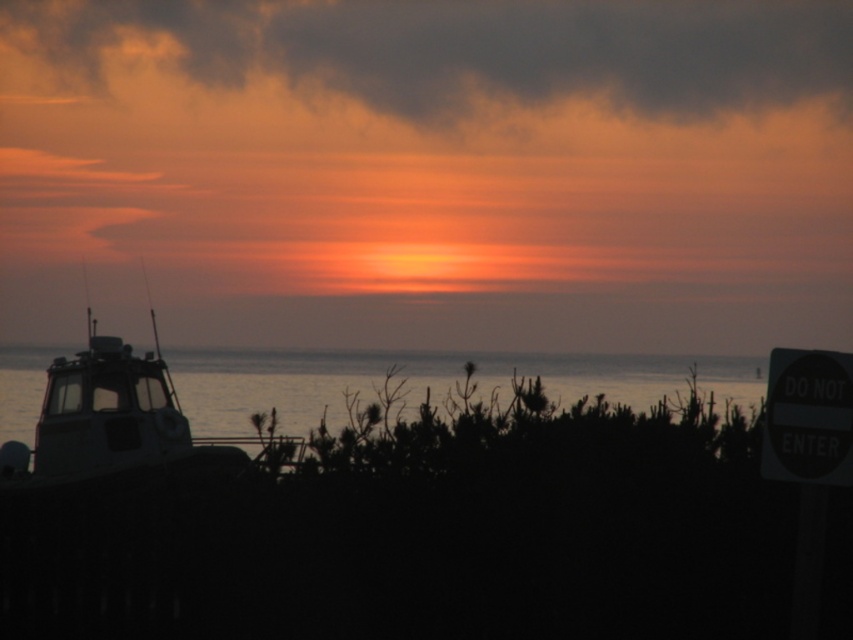
Question: From the image, what is the correct spatial relationship of smooth water at lower left in relation to black plastic sign at right?

Choices:
 (A) right
 (B) left

Answer: (B)

Question: Can you confirm if smooth water at lower left is positioned to the left of black plastic sign at right?

Choices:
 (A) no
 (B) yes

Answer: (B)

Question: Which point is farther to the camera?

Choices:
 (A) (747, 394)
 (B) (332, 42)
 (C) (811, 433)

Answer: (A)

Question: Which object is positioned closest to the cloudy sky at upper center?

Choices:
 (A) black plastic sign at right
 (B) silhouette metal boat at left
 (C) smooth water at lower left

Answer: (C)

Question: Which object appears closest to the camera in this image?

Choices:
 (A) black plastic sign at right
 (B) silhouette metal boat at left

Answer: (A)

Question: In this image, where is smooth water at lower left located relative to silhouette metal boat at left?

Choices:
 (A) above
 (B) below

Answer: (B)